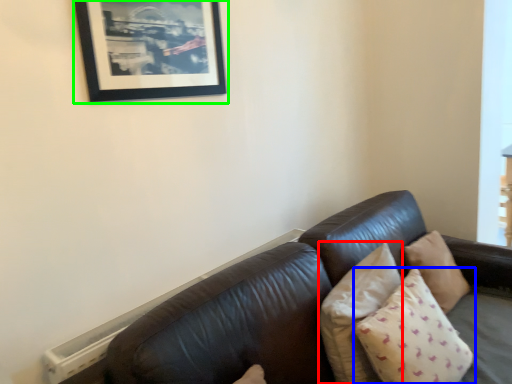
Question: Considering the real-world distances, which object is closest to pillow (highlighted by a red box)? pillow (highlighted by a blue box) or picture frame (highlighted by a green box).

Choices:
 (A) pillow
 (B) picture frame

Answer: (A)